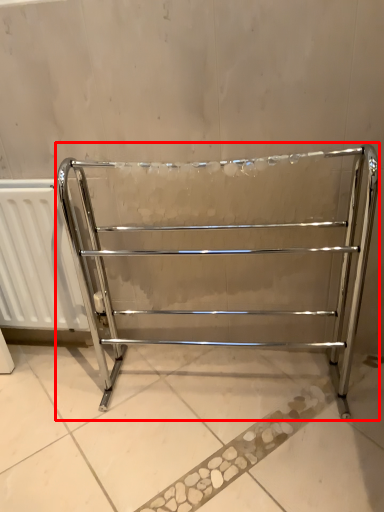
Question: From the image, what is the correct spatial relationship of furniture (annotated by the red box) in relation to radiator?

Choices:
 (A) right
 (B) left

Answer: (A)